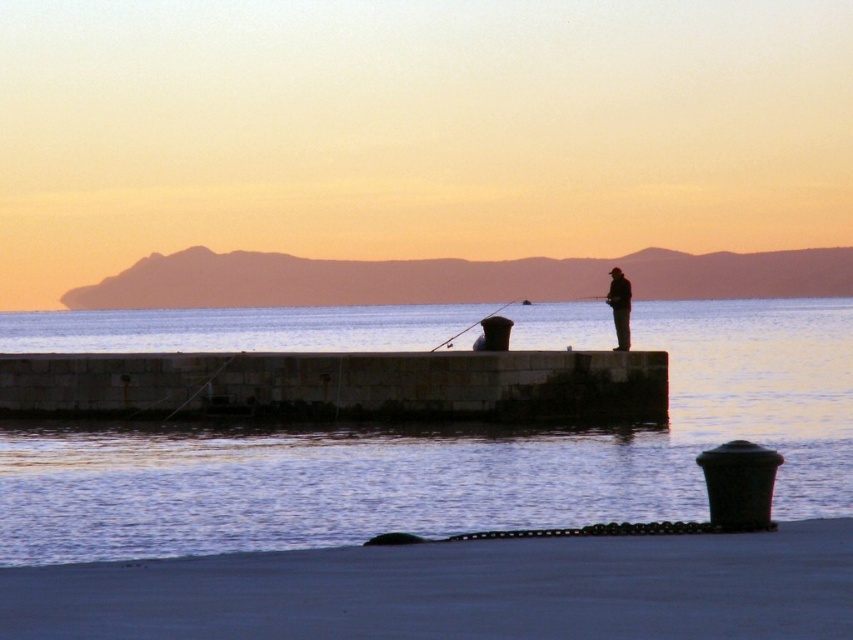
Does smooth water at center have a lesser width compared to smooth concrete pier at lower center?

No.

Consider the image. Which of these two, smooth water at center or smooth concrete pier at lower center, stands taller?

With more height is smooth water at center.

This screenshot has width=853, height=640. Describe the element at coordinates (450, 456) in the screenshot. I see `smooth water at center` at that location.

Identify the location of smooth water at center. (450, 456).

Is smooth water at center to the right of stone concrete pier at center from the viewer's perspective?

Yes, smooth water at center is to the right of stone concrete pier at center.

Between point (349, 328) and point (35, 392), which one is positioned in front?

Point (35, 392) is in front.

Locate an element on the screen. The height and width of the screenshot is (640, 853). smooth water at center is located at coordinates (450, 456).

Is smooth concrete pier at lower center below silhouette figure at center?

Correct, smooth concrete pier at lower center is located below silhouette figure at center.

Image resolution: width=853 pixels, height=640 pixels. What do you see at coordinates (459, 589) in the screenshot?
I see `smooth concrete pier at lower center` at bounding box center [459, 589].

What are the coordinates of `smooth concrete pier at lower center` in the screenshot? It's located at (459, 589).